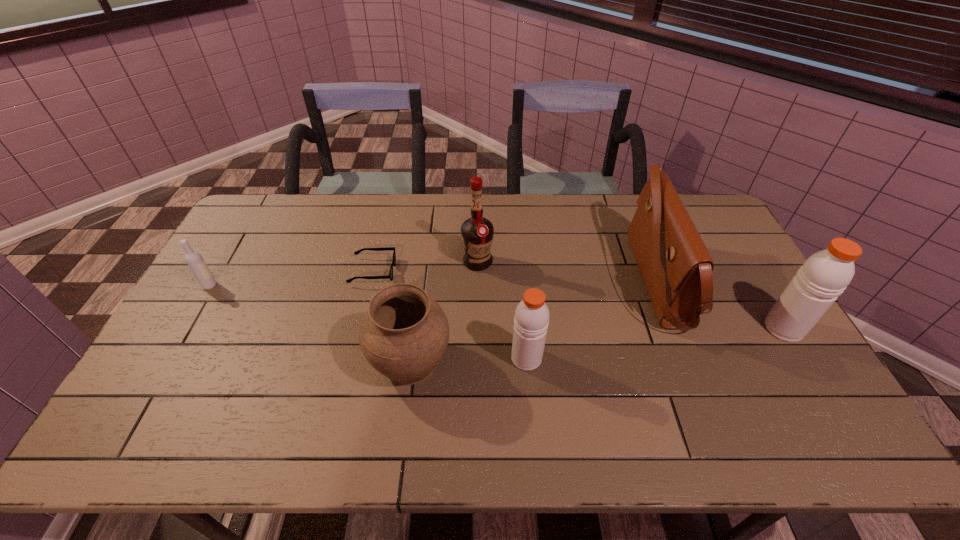
You are a GUI agent. You are given a task and a screenshot of the screen. Output one action in this format:
    pyautogui.click(x=<x>, y=<y>)
    Task: Click on the shorter shaker
    Image resolution: width=960 pixels, height=540 pixels.
    Given the screenshot: What is the action you would take?
    pyautogui.click(x=531, y=320)

Find the location of a particular element. The image size is (960, 540). the left shaker is located at coordinates (531, 320).

Where is `the right shaker`? the right shaker is located at coordinates (824, 276).

Identify the location of the taller shaker. (824, 276).

Image resolution: width=960 pixels, height=540 pixels. Identify the location of liquor. (477, 232).

You are a GUI agent. You are given a task and a screenshot of the screen. Output one action in this format:
    pyautogui.click(x=<x>, y=<y>)
    Task: Click on the shortest object
    
    Given the screenshot: What is the action you would take?
    pyautogui.click(x=390, y=276)

The image size is (960, 540). In order to click on satchel in this screenshot , I will do tap(676, 267).

Where is `urn`? urn is located at coordinates (404, 334).

Find the location of a particular element. This screenshot has width=960, height=540. vodka is located at coordinates (195, 261).

Locate an element on the screen. the leftmost object is located at coordinates (195, 261).